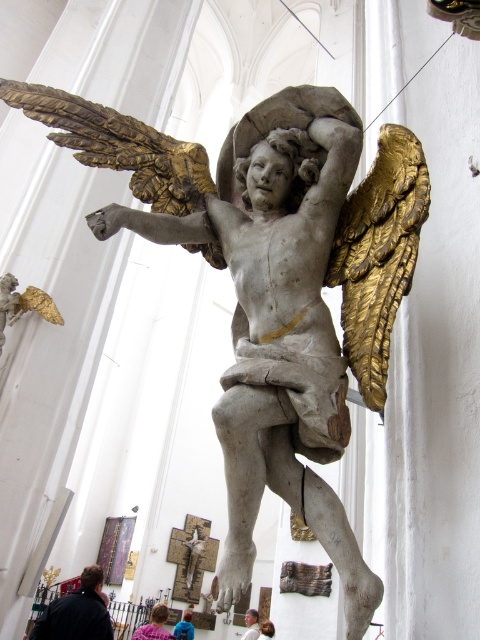
Question: Which object is farther from the camera taking this photo?

Choices:
 (A) dark brown leather jacket at lower left
 (B) blue fabric child at lower center

Answer: (B)

Question: Where is dark brown leather jacket at lower left located in relation to blonde hair at lower center in the image?

Choices:
 (A) left
 (B) right

Answer: (A)

Question: Is dark brown leather jacket at lower left to the right of blonde hair at lower center from the viewer's perspective?

Choices:
 (A) no
 (B) yes

Answer: (A)

Question: Which point is farther to the camera?

Choices:
 (A) (255, 621)
 (B) (152, 637)
 (C) (186, 636)
 (D) (97, 612)

Answer: (A)

Question: Which is farther from the blue fabric child at lower center?

Choices:
 (A) blue denim jacket at lower center
 (B) blonde hair at lower center

Answer: (B)

Question: Does dark brown leather jacket at lower left have a greater width compared to blue denim jacket at lower center?

Choices:
 (A) no
 (B) yes

Answer: (B)